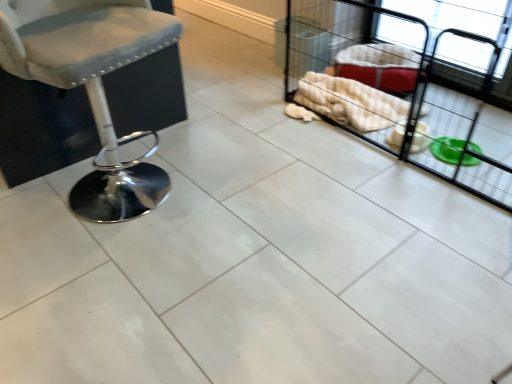
Question: Looking at the image, does matte gray fabric stool at left seem bigger or smaller compared to white fabric baby carriage at right?

Choices:
 (A) big
 (B) small

Answer: (B)

Question: Which is correct: matte gray fabric stool at left is inside white fabric baby carriage at right, or outside of it?

Choices:
 (A) outside
 (B) inside

Answer: (A)

Question: From a real-world perspective, is matte gray fabric stool at left above or below white fabric baby carriage at right?

Choices:
 (A) below
 (B) above

Answer: (B)

Question: In terms of size, does white fabric baby carriage at right appear bigger or smaller than matte gray fabric stool at left?

Choices:
 (A) big
 (B) small

Answer: (A)

Question: From a real-world perspective, is white fabric baby carriage at right physically located above or below matte gray fabric stool at left?

Choices:
 (A) below
 (B) above

Answer: (A)

Question: In the image, is white fabric baby carriage at right on the left side or the right side of matte gray fabric stool at left?

Choices:
 (A) right
 (B) left

Answer: (A)

Question: Considering their positions, is white fabric baby carriage at right located in front of or behind matte gray fabric stool at left?

Choices:
 (A) front
 (B) behind

Answer: (B)